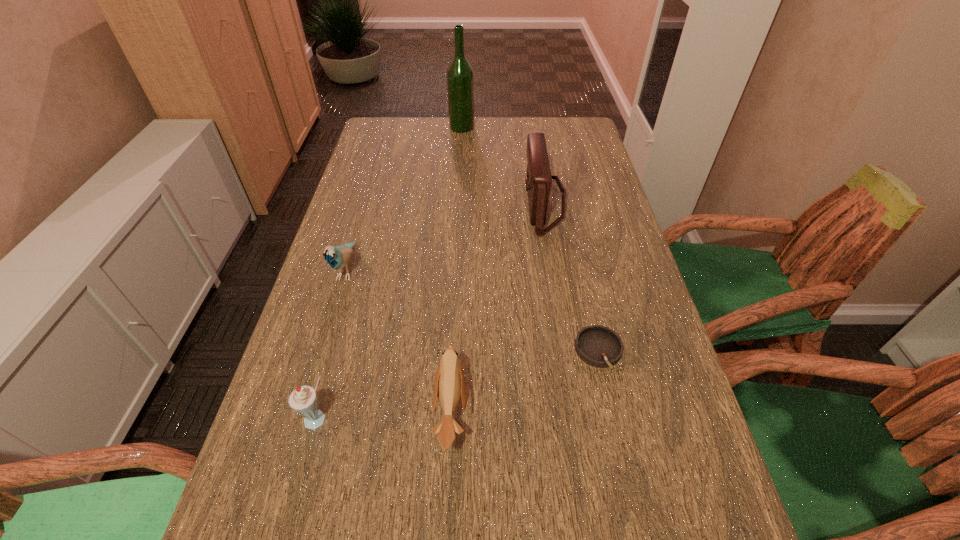
What are the coordinates of `the tallest object` in the screenshot? It's located at (460, 77).

Where is `alcohol`? This screenshot has height=540, width=960. alcohol is located at coordinates (460, 77).

This screenshot has height=540, width=960. Identify the location of shoulder bag. [x=538, y=180].

At what (x,y) coordinates should I click in order to perform the action: click on the second farthest object. Please return your answer as a coordinate pair (x, y). This screenshot has width=960, height=540. Looking at the image, I should click on (538, 180).

At what (x,y) coordinates should I click in order to perform the action: click on the left bird. Please return your answer as a coordinate pair (x, y). Image resolution: width=960 pixels, height=540 pixels. Looking at the image, I should click on (337, 257).

Locate an element on the screen. The image size is (960, 540). the taller bird is located at coordinates (337, 257).

Locate an element on the screen. milkshake is located at coordinates (303, 400).

The width and height of the screenshot is (960, 540). What are the coordinates of `the right bird` in the screenshot? It's located at (449, 385).

At what (x,y) coordinates should I click in order to perform the action: click on the nearer bird. Please return your answer as a coordinate pair (x, y). The image size is (960, 540). Looking at the image, I should click on (449, 385).

Identify the location of the shortest object. Image resolution: width=960 pixels, height=540 pixels. (599, 346).